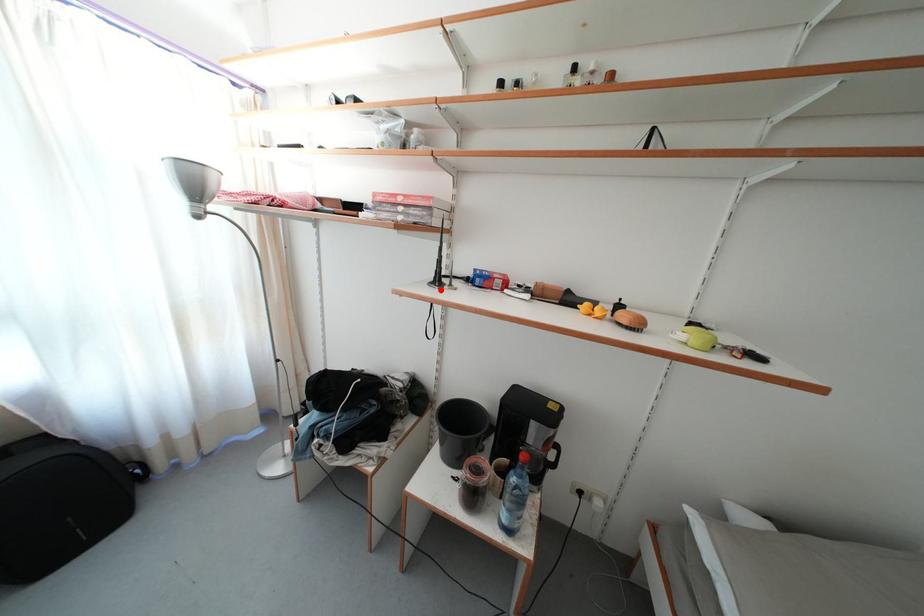
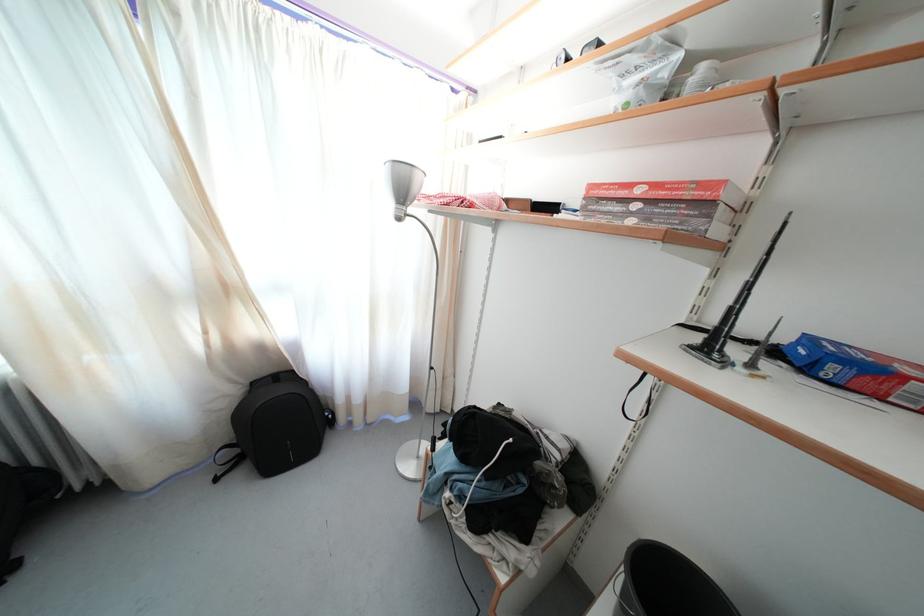
Locate, in the second image, the point that corresponds to the highlighted location in the first image.

(714, 361)